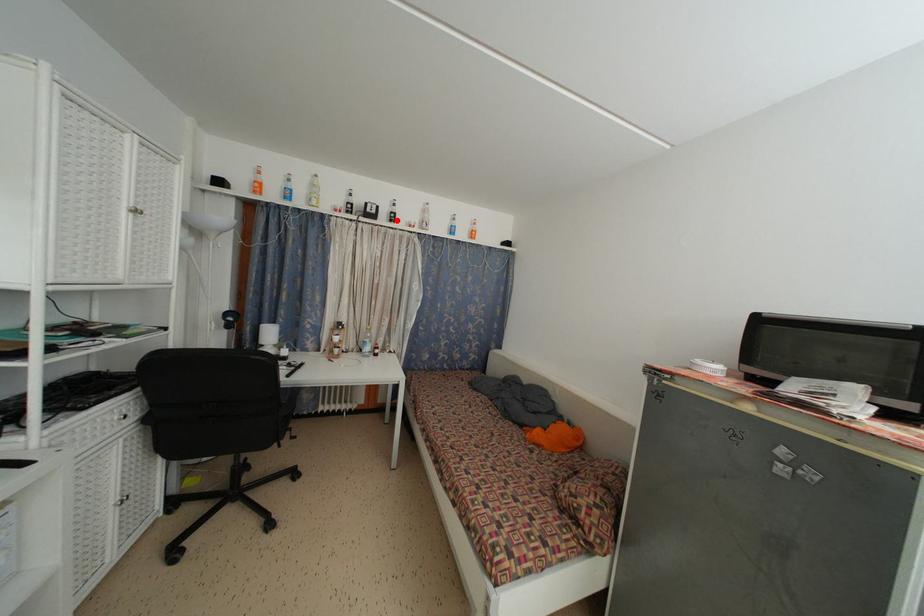
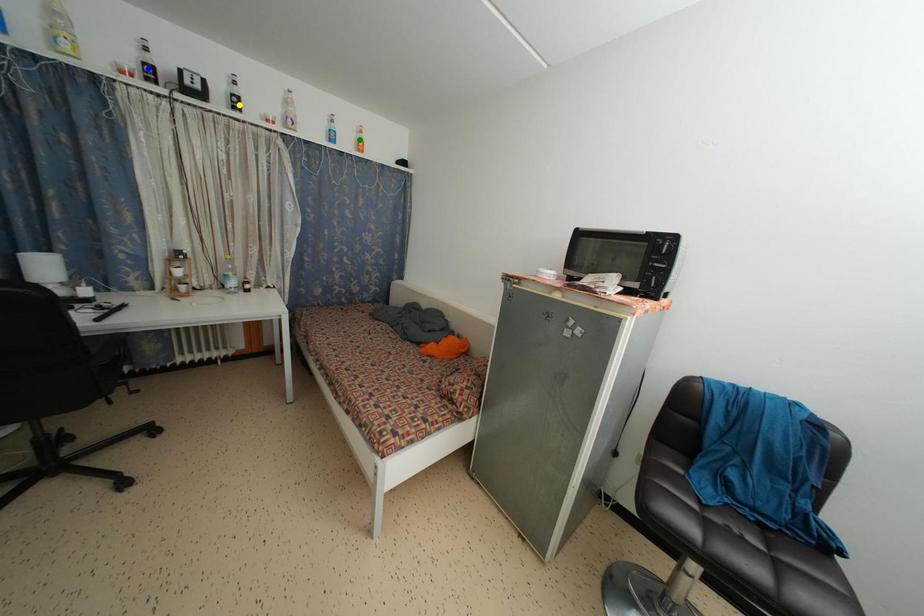
Question: I am providing you with two images of the same scene from different viewpoints. A red point is marked on the first image. You are given multiple points on the second image. Which spot in image 2 lines up with the point in image 1?

Choices:
 (A) blue point
 (B) yellow point
 (C) green point

Answer: (B)